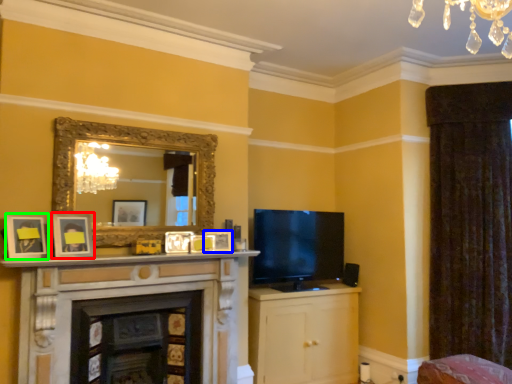
Question: Considering the real-world distances, which object is farthest from picture frame (highlighted by a red box)? picture frame (highlighted by a blue box) or picture frame (highlighted by a green box)?

Choices:
 (A) picture frame
 (B) picture frame

Answer: (A)